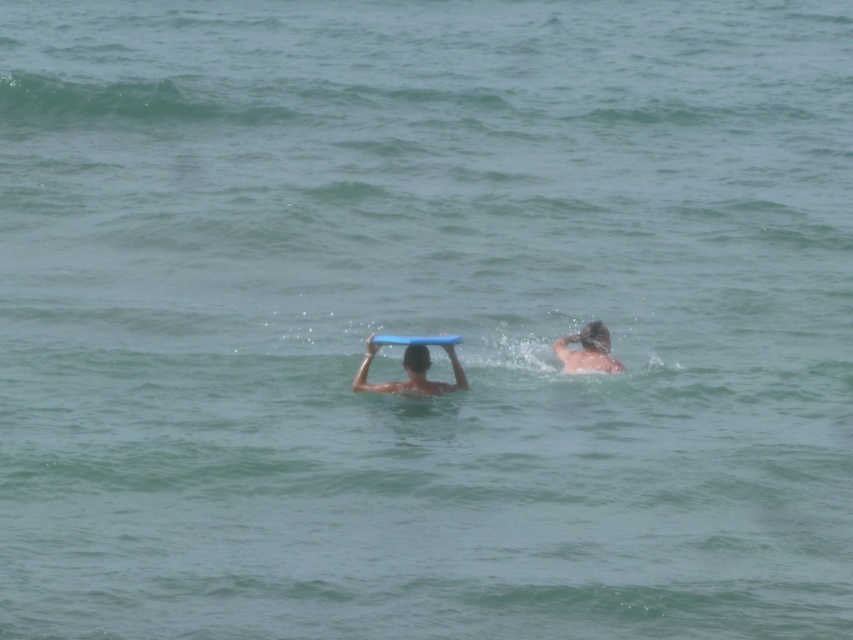
Looking at this image, you are planning to use one of the surfboards for a short ride. Given that the blue matte surfboard at center is larger than the blue foam surfboard at center, which one would provide better stability for a beginner?

The blue matte surfboard at center is larger and therefore provides better stability for a beginner compared to the blue foam surfboard at center.

You are a drone operator trying to capture a photo of two people in the ocean. The first person is at point (444,342) and the second is at point (390,333). To ensure both are in focus, you need to know which point is closer to the camera. According to the scene description, which point is in front?

Point (444,342) is in front of point (390,333), so the camera should focus on that point first to ensure both are in focus.

You are a lifeguard observing two surfboards in the water. You see the blue matte surfboard at center and the blue foam surfboard at center. Which one is positioned lower in the water?

The blue matte surfboard at center is located below the blue foam surfboard at center, so it is positioned lower in the water.